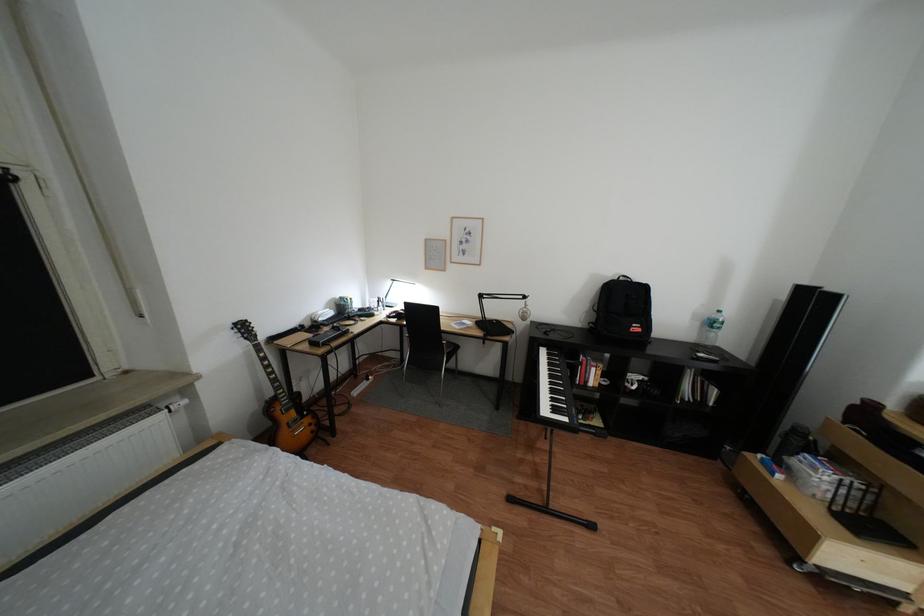
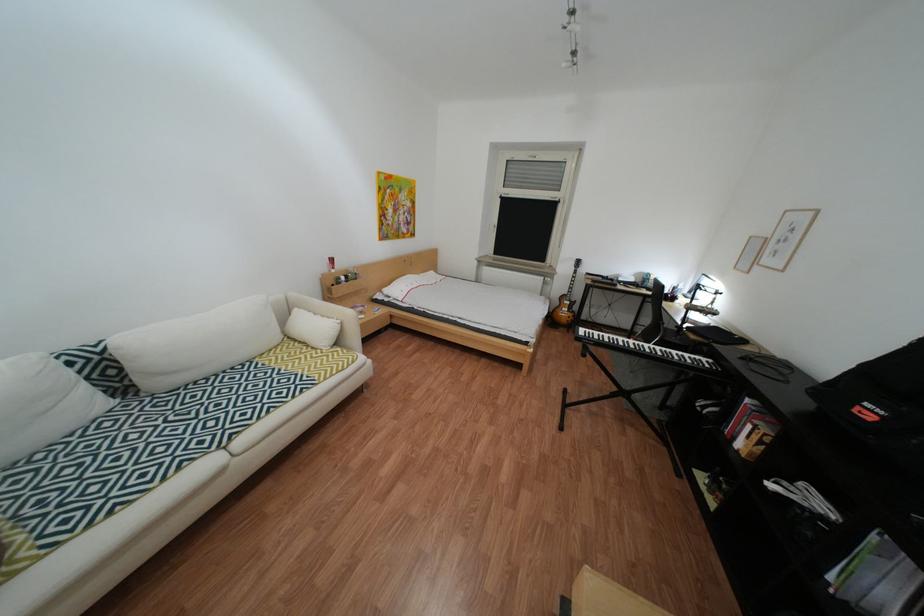
In the second image, find the point that corresponds to point 602,383 in the first image.

(749, 439)